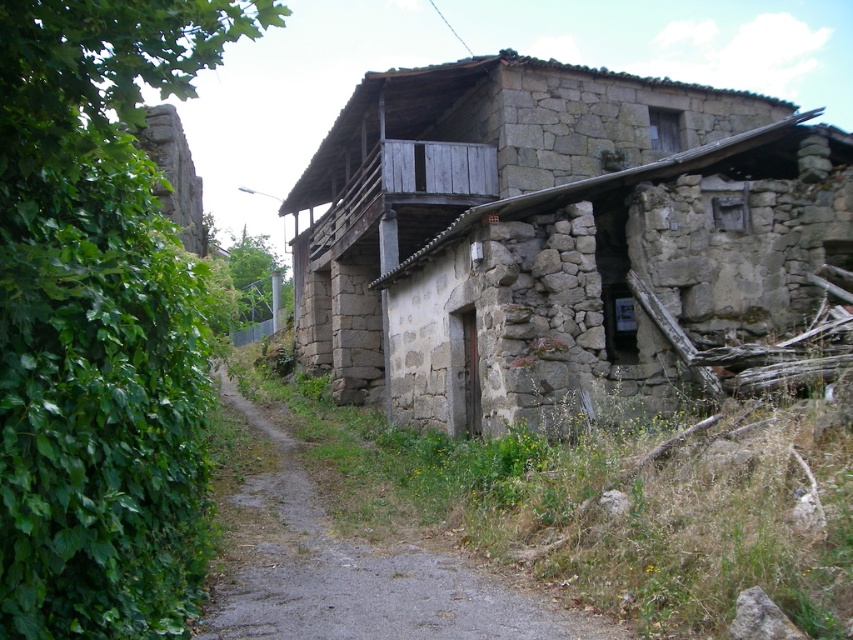
You are standing at the point marked as point (103, 592) in the image. You want to walk to the door of the rustic stone building. The door is partially hidden by plants. Can you estimate how far you are from the door?

The distance between you and the door is approximately 4.34 meters because the point (103, 592) and viewer are 4.34 meters apart from each other.

You are standing at point (502, 609) and want to walk to the door of the rustic stone building. There is another point at (759, 168). Which point is closer to the door?

Point (759, 168) is behind point (502, 609), so the door is closer to point (502, 609).

You are standing at the origin point of the coordinate system. Where is the gray stone house at center located?

The gray stone house at center is located at point [550,234].